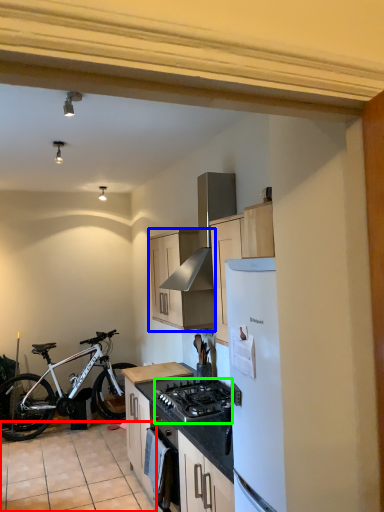
Question: Which is nearer to the tile (highlighted by a red box)? cabinetry (highlighted by a blue box) or gas stove (highlighted by a green box).

Choices:
 (A) cabinetry
 (B) gas stove

Answer: (B)